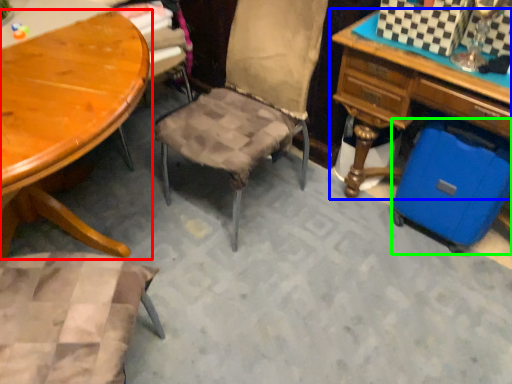
Question: Based on their relative distances, which object is farther from table (highlighted by a red box)? Choose from desk (highlighted by a blue box) and luggage (highlighted by a green box).

Choices:
 (A) desk
 (B) luggage

Answer: (B)